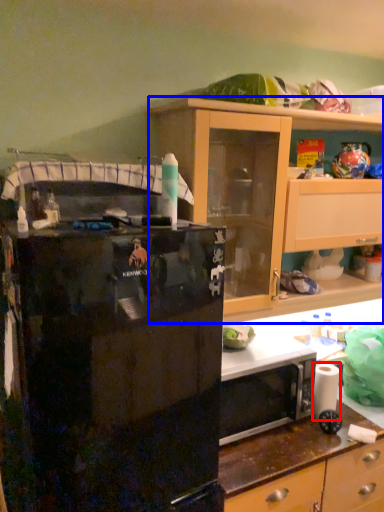
Question: Which of the following is the closest to the observer, toilet paper (highlighted by a red box) or cabinetry (highlighted by a blue box)?

Choices:
 (A) toilet paper
 (B) cabinetry

Answer: (B)